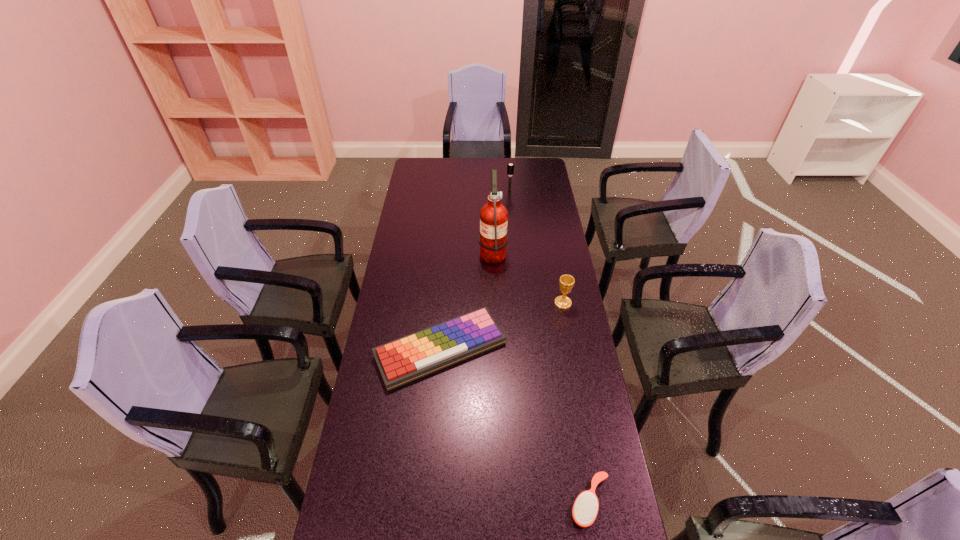
In order to click on vacant region located 0.170m on the nozzle and handle of the fire extinguisher in this screenshot , I will do `click(441, 251)`.

The width and height of the screenshot is (960, 540). Identify the location of free location located 0.330m on the front of the taller hairbrush. (513, 228).

Identify the location of vacant region located 0.180m on the left of the chalice. This screenshot has width=960, height=540. (510, 303).

This screenshot has width=960, height=540. In order to click on vacant area situated on the front of the computer keyboard in this screenshot , I will do `click(432, 458)`.

Find the location of a particular element. free location located on the left of the nearer hairbrush is located at coordinates (441, 502).

You are a GUI agent. You are given a task and a screenshot of the screen. Output one action in this format:
    pyautogui.click(x=<x>, y=<y>)
    Task: Click on the object positioned at the left edge
    
    Given the screenshot: What is the action you would take?
    pyautogui.click(x=406, y=359)

The height and width of the screenshot is (540, 960). What are the coordinates of `chalice that is positioned at the right edge` in the screenshot? It's located at (566, 282).

Where is `hairbrush that is at the right edge`? This screenshot has height=540, width=960. hairbrush that is at the right edge is located at coordinates (585, 509).

In the image, there is a desktop. Find the location of `vacant space at the far edge`. vacant space at the far edge is located at coordinates (468, 172).

Where is `vacant space at the left edge`? This screenshot has height=540, width=960. vacant space at the left edge is located at coordinates (404, 205).